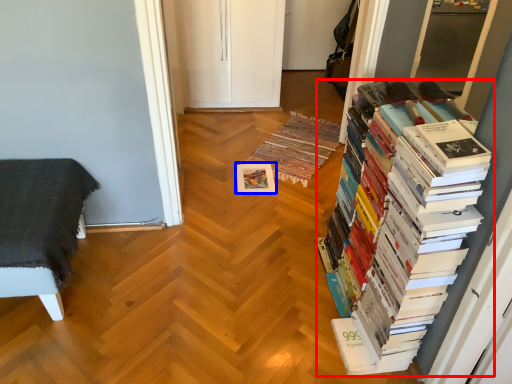
Question: Which of the following is the farthest to the observer, book (highlighted by a red box) or paperback book (highlighted by a blue box)?

Choices:
 (A) book
 (B) paperback book

Answer: (B)